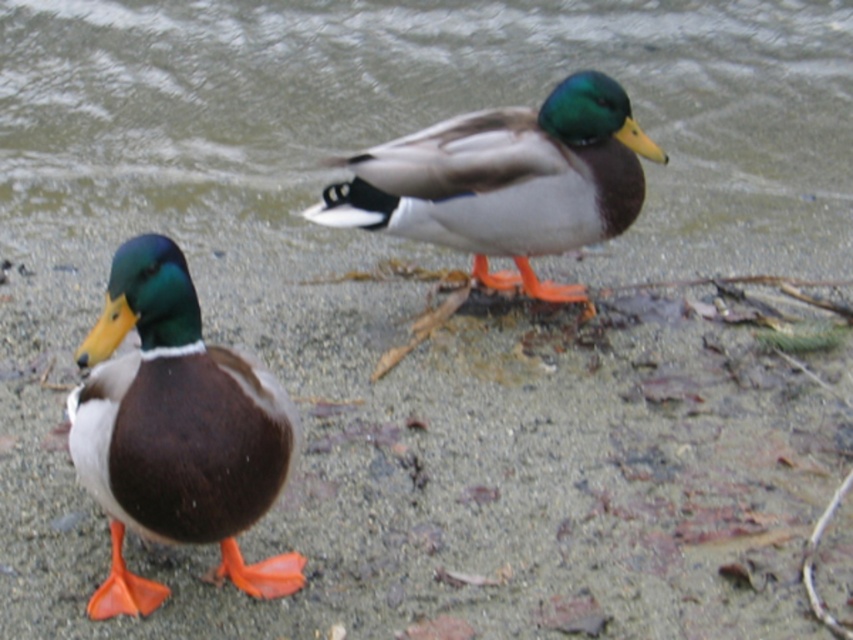
Question: Estimate the real-world distances between objects in this image. Which object is closer to the clear water at upper center?

Choices:
 (A) matte brown duck at left
 (B) shiny brown duck at center

Answer: (B)

Question: Is clear water at upper center smaller than shiny brown duck at center?

Choices:
 (A) no
 (B) yes

Answer: (A)

Question: Which point is closer to the camera?

Choices:
 (A) tap(152, 310)
 (B) tap(593, 10)

Answer: (A)

Question: Which object appears farthest from the camera in this image?

Choices:
 (A) shiny brown duck at center
 (B) clear water at upper center
 (C) matte brown duck at left

Answer: (B)

Question: Does matte brown duck at left lie behind shiny brown duck at center?

Choices:
 (A) no
 (B) yes

Answer: (A)

Question: Is matte brown duck at left to the right of shiny brown duck at center from the viewer's perspective?

Choices:
 (A) no
 (B) yes

Answer: (A)